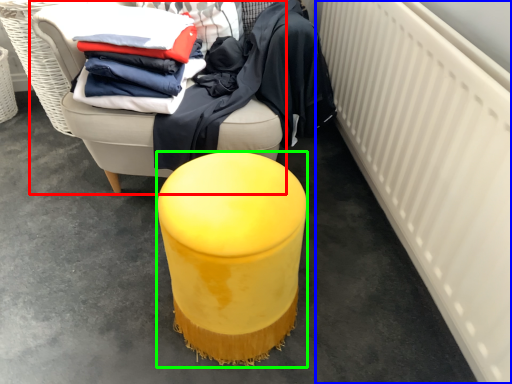
Question: Which object is positioned farthest from furniture (highlighted by a red box)? Select from radiator (highlighted by a blue box) and furniture (highlighted by a green box).

Choices:
 (A) radiator
 (B) furniture

Answer: (A)